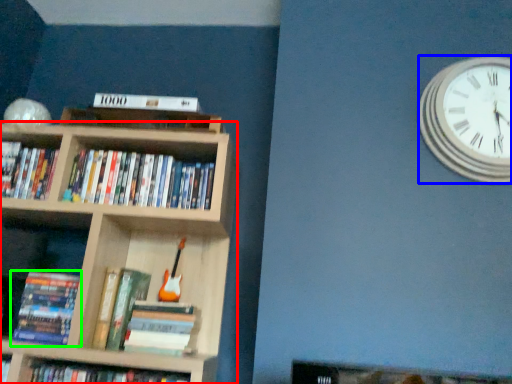
Question: Which object is the farthest from bookcase (highlighted by a red box)? Choose among these: wall clock (highlighted by a blue box) or book (highlighted by a green box).

Choices:
 (A) wall clock
 (B) book

Answer: (A)